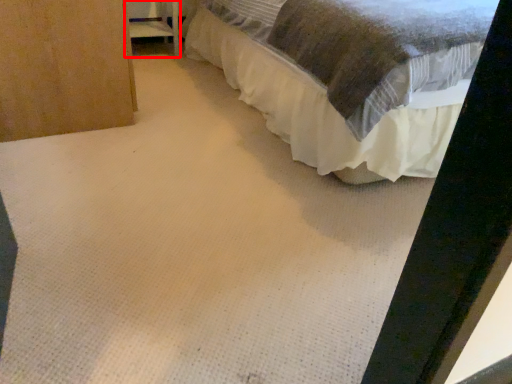
Question: Considering the relative positions of furniture (annotated by the red box) and bed in the image provided, where is furniture (annotated by the red box) located with respect to the staircase?

Choices:
 (A) left
 (B) right

Answer: (A)